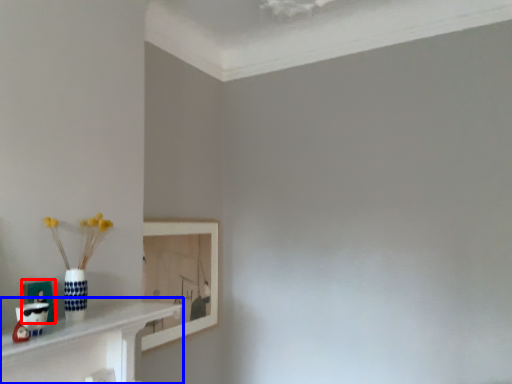
Question: Among these objects, which one is farthest to the camera, picture frame (highlighted by a red box) or shelf (highlighted by a blue box)?

Choices:
 (A) picture frame
 (B) shelf

Answer: (A)